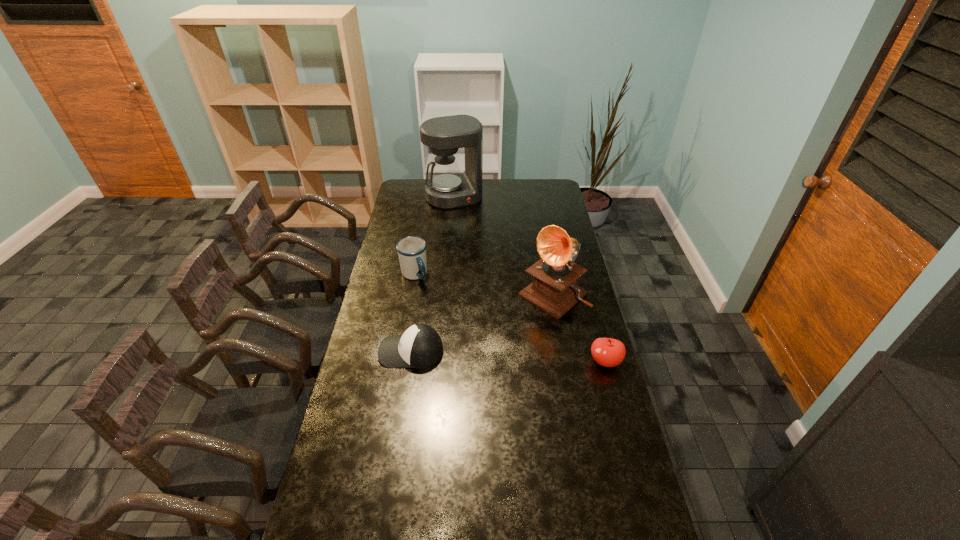
Locate an element on the screen. vacant space on the desktop that is between the cap and the apple and is positioned on the handle side of the mug is located at coordinates (489, 355).

Identify the location of vacant space on the desktop that is between the cap and the apple and is positioned on the horn of the fourth shortest object. (479, 355).

Image resolution: width=960 pixels, height=540 pixels. Find the location of `vacant space on the desktop that is between the cap and the apple and is positioned on the front-facing side of the farthest object`. vacant space on the desktop that is between the cap and the apple and is positioned on the front-facing side of the farthest object is located at coordinates (529, 357).